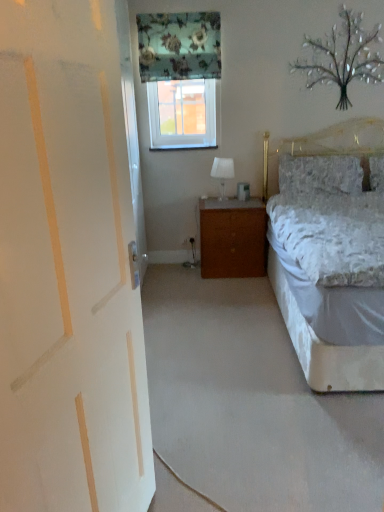
Image resolution: width=384 pixels, height=512 pixels. Identify the location of free spot in front of brown wood nightstand at center. (225, 286).